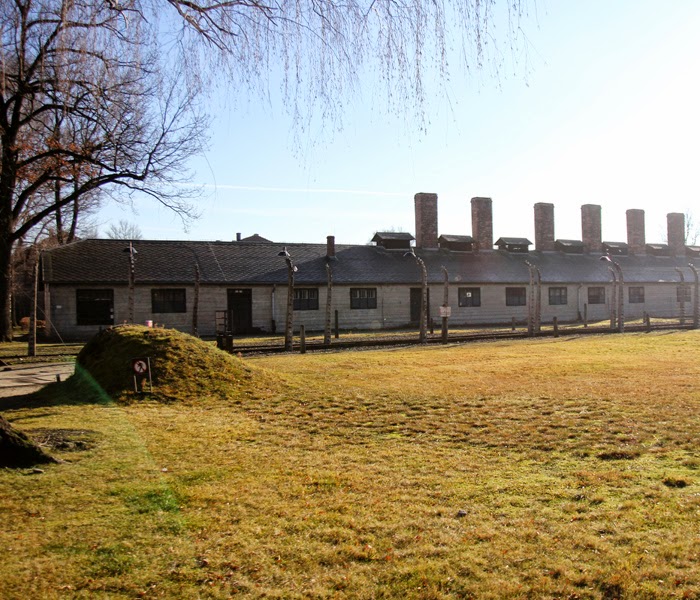
Find the location of a particular element. The height and width of the screenshot is (600, 700). windows is located at coordinates (90, 306), (167, 296), (304, 301), (357, 295), (470, 298), (518, 293), (556, 294), (593, 294), (638, 293), (684, 296).